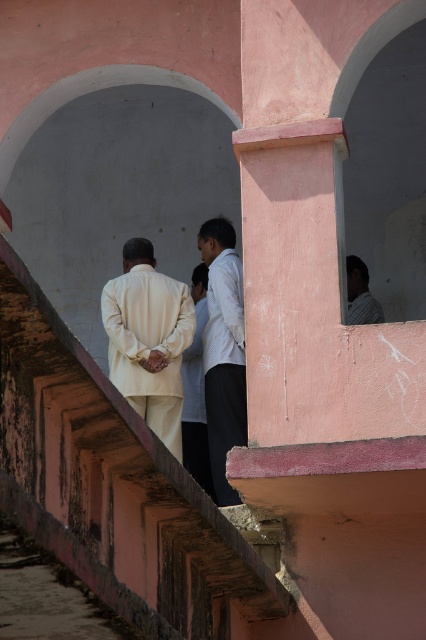
Question: Does matte cream suit at center have a smaller size compared to white matte shirt at center?

Choices:
 (A) no
 (B) yes

Answer: (A)

Question: Is matte cream suit at center in front of light brown shirt at upper right?

Choices:
 (A) no
 (B) yes

Answer: (B)

Question: Which of the following is the closest to the observer?

Choices:
 (A) light beige fabric robe at center
 (B) white matte shirt at center

Answer: (B)

Question: Based on their relative distances, which object is farther from the light beige fabric robe at center?

Choices:
 (A) white matte shirt at center
 (B) light brown shirt at upper right
 (C) matte cream suit at center

Answer: (B)

Question: Estimate the real-world distances between objects in this image. Which object is farther from the white matte shirt at center?

Choices:
 (A) matte cream suit at center
 (B) light beige fabric robe at center
 (C) light brown shirt at upper right

Answer: (C)

Question: Is matte cream suit at center below light beige fabric robe at center?

Choices:
 (A) yes
 (B) no

Answer: (B)